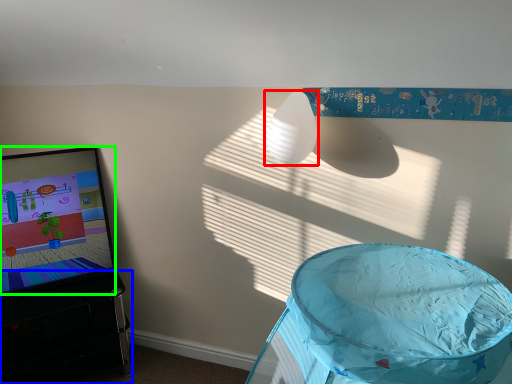
Question: Which object is the farthest from lamp (highlighted by a red box)? Choose among these: furniture (highlighted by a blue box) or computer screen (highlighted by a green box).

Choices:
 (A) furniture
 (B) computer screen

Answer: (A)